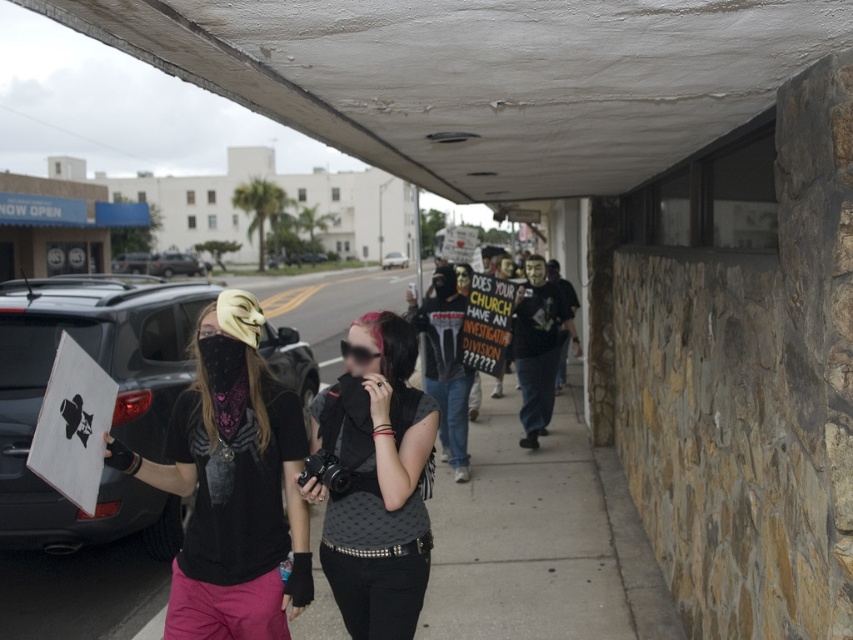
You are a photographer trying to capture a clear shot of the silver metallic sedan at center. However, there is a matte black camera at center blocking your view. Can you see the sedan through the camera?

The matte black camera at center is below the silver metallic sedan at center, so you cannot see the sedan through the camera since the camera is positioned in front of it.

You are a painter standing on the sidewalk and looking up at the white textured ceiling at upper center and the silver metallic sedan at center. Which object appears bigger in your view?

The white textured ceiling at upper center appears bigger in your view because it is larger in size than the silver metallic sedan at center.

You are a delivery person with a cart that is 12 feet long. You need to move your cart between the black matte car at left and the matte black camera at center. Can your cart fit through the space between them?

The black matte car at left is 10.92 feet from the matte black camera at center, so the cart that is 12 feet long cannot fit through the space between them because the distance is shorter than the cart length.